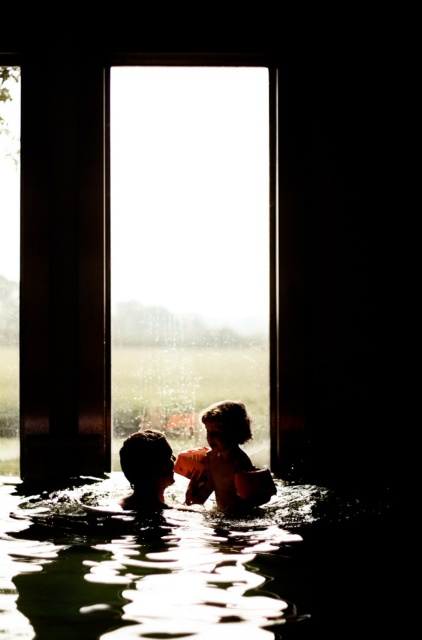
Question: Can you confirm if clear liquid water at center is wider than dark wood pillar at left?

Choices:
 (A) yes
 (B) no

Answer: (A)

Question: Which point is closer to the camera?

Choices:
 (A) (86, 387)
 (B) (124, 460)

Answer: (B)

Question: Which point is farther to the camera?

Choices:
 (A) dark wood pillar at left
 (B) matte orange life vest at center

Answer: (A)

Question: Which point appears closest to the camera in this image?

Choices:
 (A) (x=207, y=465)
 (B) (x=56, y=500)

Answer: (B)

Question: Does matte orange life vest at center have a greater width compared to silky brown hair at center?

Choices:
 (A) no
 (B) yes

Answer: (B)

Question: Is matte orange life vest at center thinner than silky brown hair at center?

Choices:
 (A) yes
 (B) no

Answer: (B)